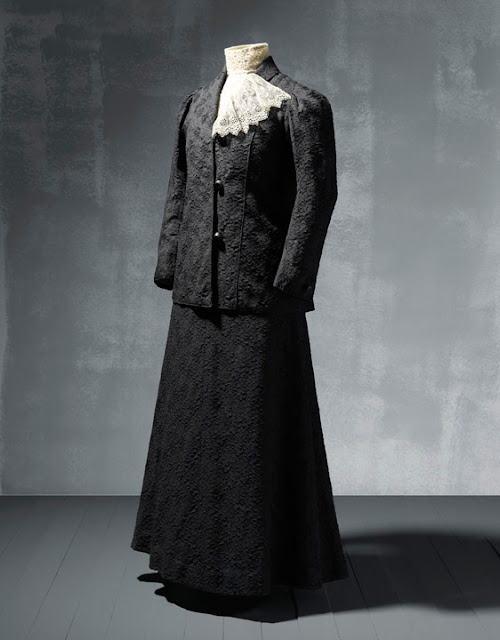
Locate an element on the screen. The image size is (500, 640). gray floor is located at coordinates (114, 580).